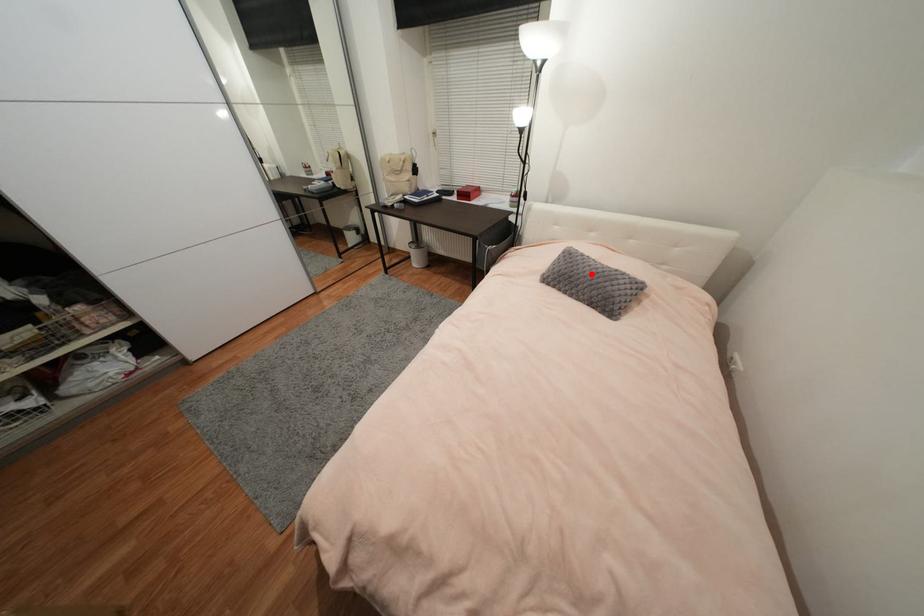
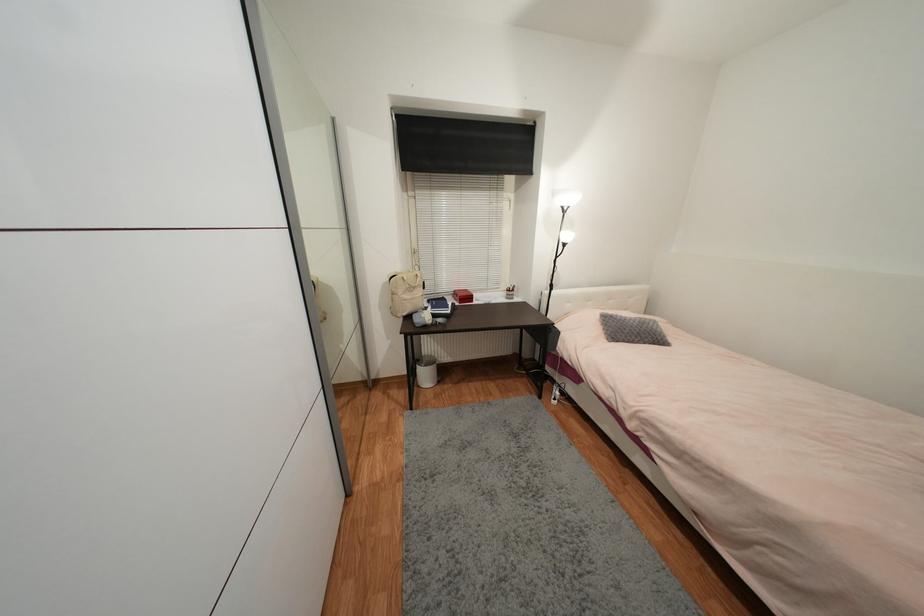
The point at the highlighted location is marked in the first image. Where is the corresponding point in the second image?

(639, 326)